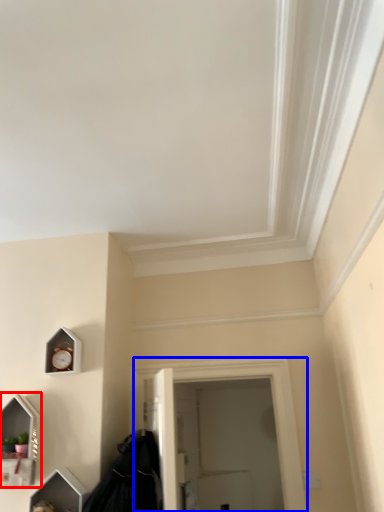
Question: Which object appears closest to the camera in this image, medicine cabinet (highlighted by a red box) or window (highlighted by a blue box)?

Choices:
 (A) medicine cabinet
 (B) window

Answer: (A)